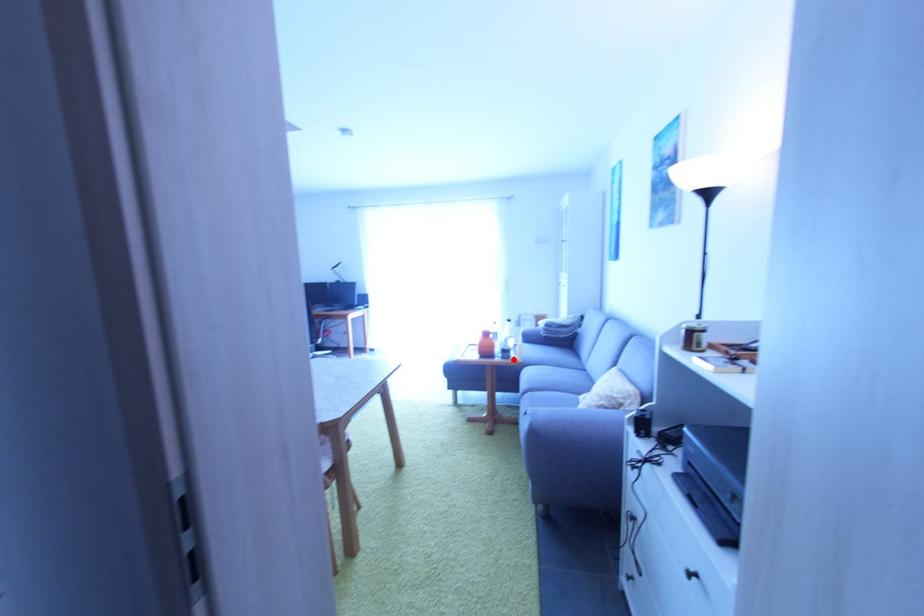
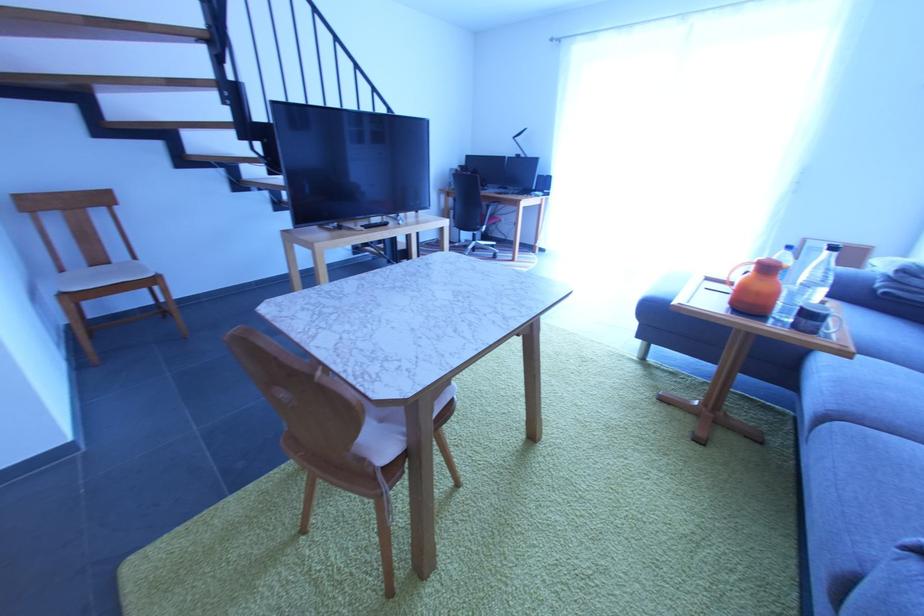
In the second image, find the point that corresponds to the highlighted location in the first image.

(819, 334)